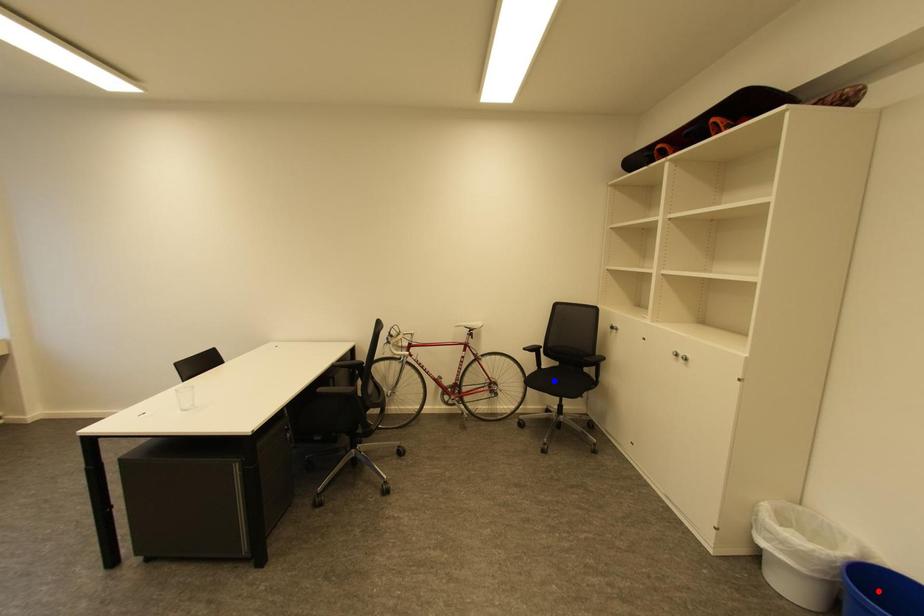
Question: Two points are marked on the image. Which point is closer to the camera?

Choices:
 (A) Blue point is closer.
 (B) Red point is closer.

Answer: (B)